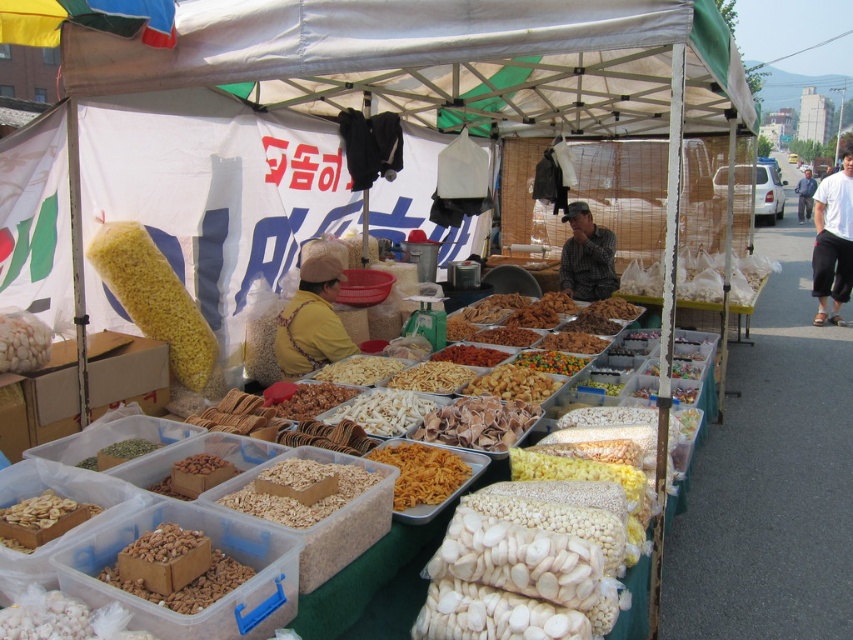
You are standing at the entrance of the market stall and want to locate the yellow fabric at center. Based on the coordinates given, can you estimate its position relative to the entrance?

The yellow fabric at center is located at coordinates approximately halfway along the horizontal axis and slightly below the center vertically, so it should be positioned near the middle of the stall, closer to the entrance.

You are a customer at the market and want to pick up the white cotton shirt at center. Which direction should you move relative to the yellow fabric at center?

The yellow fabric at center is to the left of the white cotton shirt at center, so you should move to the right relative to the yellow fabric at center to reach the white cotton shirt at center.